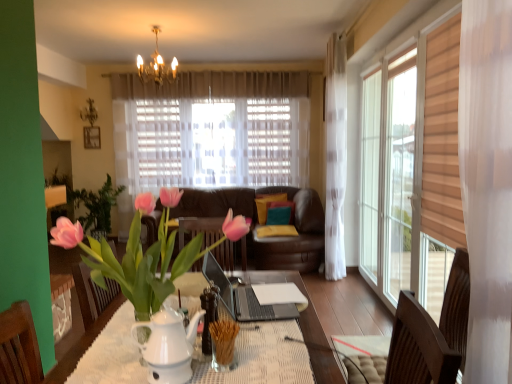
Question: Does velvet teal pillow at center, the 2th pillow viewed from the back, have a lesser width compared to pink glossy tulip at center?

Choices:
 (A) no
 (B) yes

Answer: (B)

Question: Is pink glossy tulip at center at the back of velvet teal pillow at center, the 2th pillow viewed from the back?

Choices:
 (A) yes
 (B) no

Answer: (B)

Question: Can you confirm if velvet teal pillow at center, the 2th pillow viewed from the back, is positioned to the right of pink glossy tulip at center?

Choices:
 (A) yes
 (B) no

Answer: (A)

Question: Is velvet teal pillow at center, arranged as the 1th pillow when viewed from the front, placed right next to pink glossy tulip at center?

Choices:
 (A) no
 (B) yes

Answer: (A)

Question: Is velvet teal pillow at center, the 2th pillow viewed from the back, shorter than pink glossy tulip at center?

Choices:
 (A) yes
 (B) no

Answer: (A)

Question: Considering the positions of gold crystal chandelier at upper center and velvet yellow pillow at center, placed as the first pillow when sorted from back to front, in the image, is gold crystal chandelier at upper center bigger or smaller than velvet yellow pillow at center, placed as the first pillow when sorted from back to front,?

Choices:
 (A) small
 (B) big

Answer: (B)

Question: In the image, is gold crystal chandelier at upper center positioned in front of or behind velvet yellow pillow at center, the second pillow from the front?

Choices:
 (A) front
 (B) behind

Answer: (A)

Question: From the image's perspective, relative to velvet yellow pillow at center, the second pillow from the front, is gold crystal chandelier at upper center above or below?

Choices:
 (A) below
 (B) above

Answer: (B)

Question: In terms of width, does gold crystal chandelier at upper center look wider or thinner when compared to velvet yellow pillow at center, placed as the first pillow when sorted from back to front?

Choices:
 (A) wide
 (B) thin

Answer: (A)

Question: Considering their positions, is velvet yellow pillow at center, placed as the first pillow when sorted from back to front, located in front of or behind wooden picture frame at upper left?

Choices:
 (A) front
 (B) behind

Answer: (A)

Question: In terms of height, does velvet yellow pillow at center, placed as the first pillow when sorted from back to front, look taller or shorter compared to wooden picture frame at upper left?

Choices:
 (A) short
 (B) tall

Answer: (B)

Question: Looking at their shapes, would you say velvet yellow pillow at center, the second pillow from the front, is wider or thinner than wooden picture frame at upper left?

Choices:
 (A) wide
 (B) thin

Answer: (A)

Question: From the image's perspective, is velvet yellow pillow at center, placed as the first pillow when sorted from back to front, above or below wooden picture frame at upper left?

Choices:
 (A) above
 (B) below

Answer: (B)

Question: Relative to pink glossy tulip at center, is wooden picture frame at upper left in front or behind?

Choices:
 (A) behind
 (B) front

Answer: (A)

Question: Is wooden picture frame at upper left inside or outside of pink glossy tulip at center?

Choices:
 (A) outside
 (B) inside

Answer: (A)